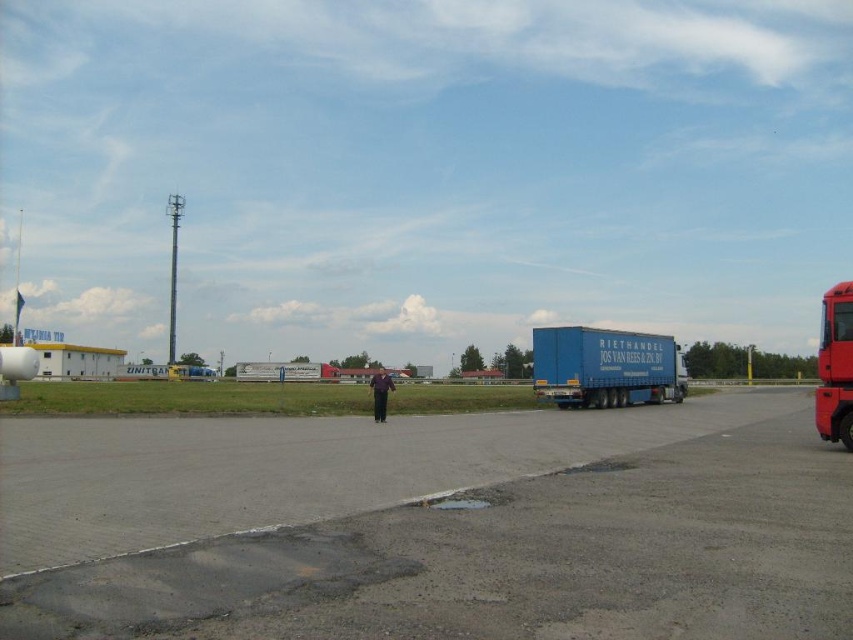
You are standing at the point marked by the coordinates (430, 525) in the image. What type of surface are you standing on?

The point at coordinates (430, 525) indicates asphalt at center, so you are standing on asphalt.

You are standing at the point marked as point (x=664, y=360) in the image. You want to take a photo of the blue semi truck with the text RIETHANDEL JOS VAN REES 022 BY on its trailer. Can you see the truck from your current position?

The point (x=664, y=360) is 46.14 meters away from the camera. Since the truck is in the mid ground of the image, it is likely within the camera view. Therefore, you can see the blue semi truck with the text RIETHANDEL JOS VAN REES 022 BY on its trailer from your current position at point (x=664, y=360).

You are a delivery driver who needs to park your truck on the asphalt at center without blocking the blue matte trailer at right. Is there enough space between them?

The asphalt at center is located below the blue matte trailer at right, so there is sufficient space to park the truck on the asphalt at center without blocking the trailer.